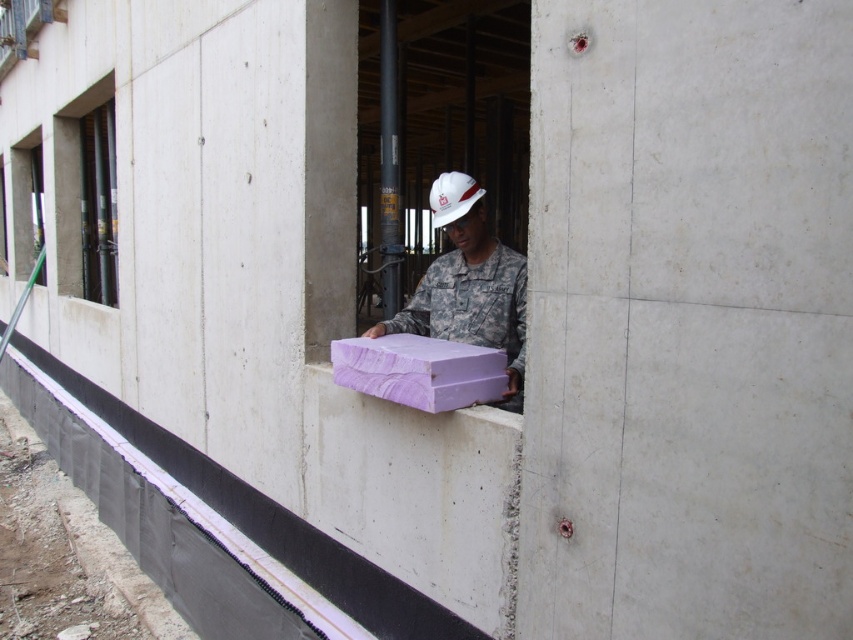
You are a construction worker standing at the edge of the partially constructed building. You need to install a new black glass window at the location marked by point (86, 195). Based on the scene, where exactly should you place the window?

The point (86, 195) indicates the location of the black glass window at upper left, so you should place the window at the upper left section of the exterior wall.

You are a safety inspector at the construction site. You need to ensure that the black glass window at upper left and the purple wood at center are installed according to the blueprint. According to the blueprint, the window must be taller than the wooden structure. Does the current placement meet the requirement?

The black glass window at upper left is taller than purple wood at center, so the current placement meets the blueprint requirement.